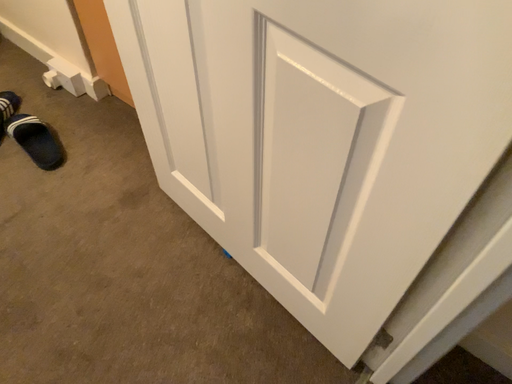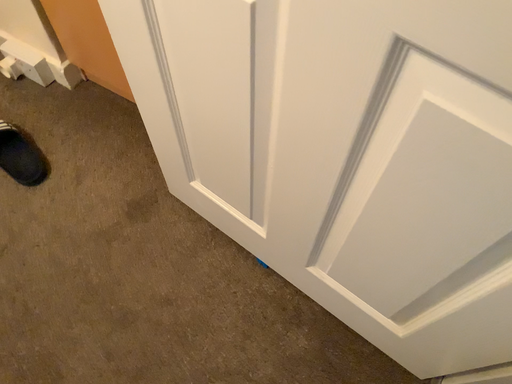
Question: Which way did the camera rotate in the video?

Choices:
 (A) rotated upward
 (B) rotated downward

Answer: (B)